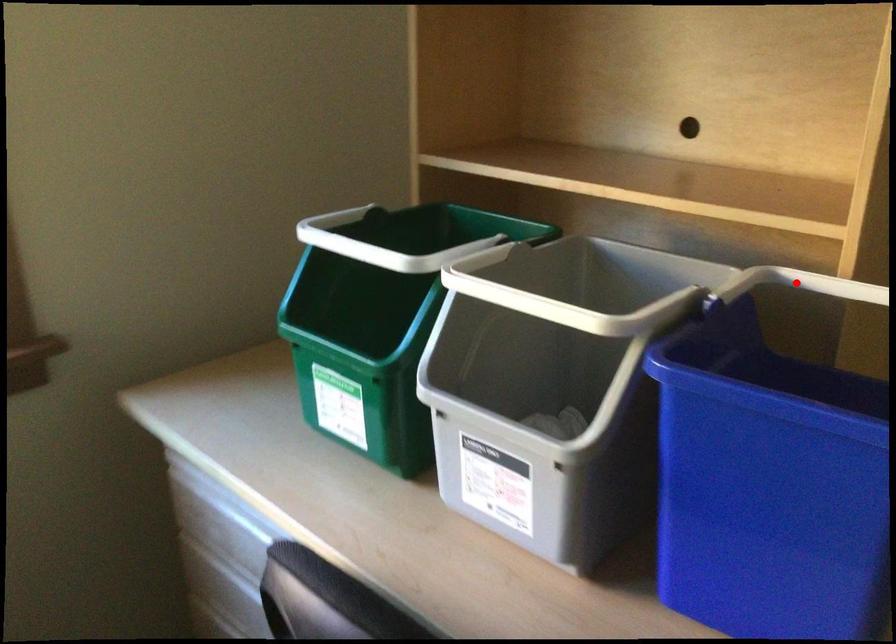
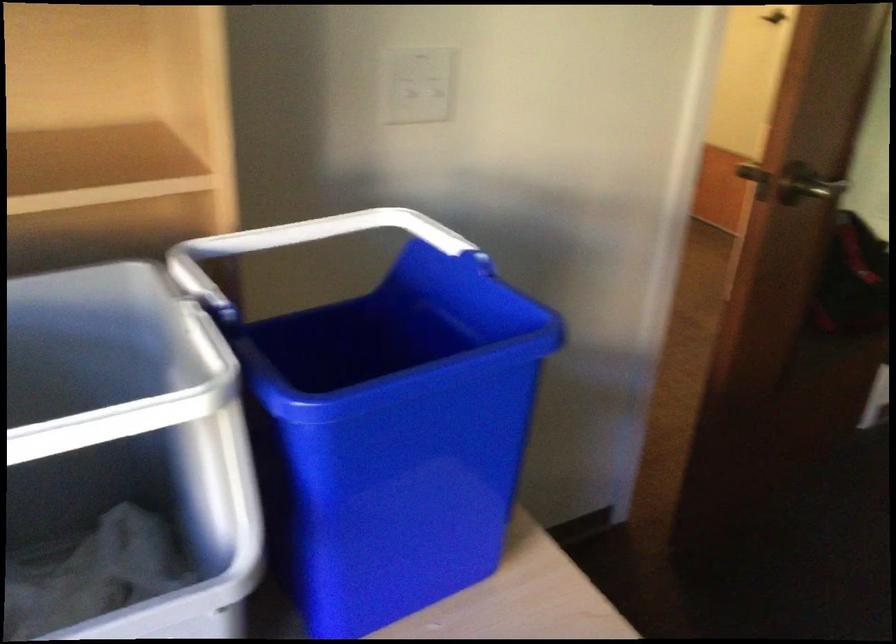
Where in the second image is the point corresponding to the highlighted location from the first image?

(213, 257)